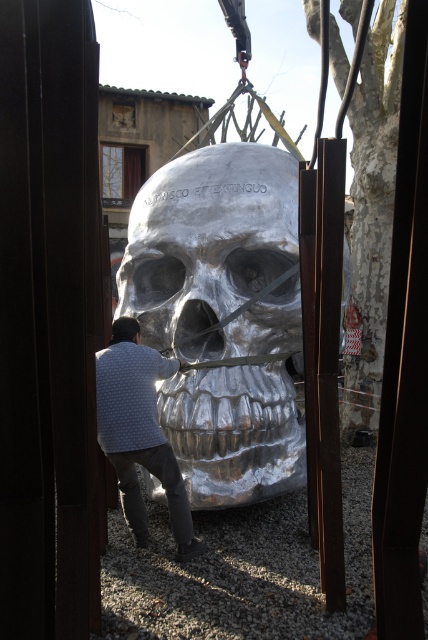
In the scene shown: Who is lower down, shiny silver skull at center or white dotted sweater at center?

white dotted sweater at center

Is shiny silver skull at center below white dotted sweater at center?

No.

Locate an element on the screen. Image resolution: width=428 pixels, height=640 pixels. shiny silver skull at center is located at coordinates (222, 316).

Where is `shiny silver skull at center`? This screenshot has height=640, width=428. shiny silver skull at center is located at coordinates (222, 316).